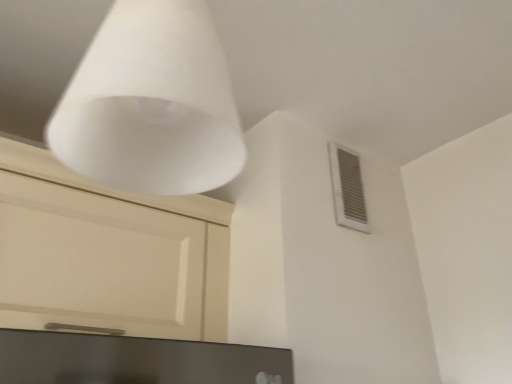
Question: Does white plastic vent at upper right turn towards white matte cone at upper center?

Choices:
 (A) no
 (B) yes

Answer: (A)

Question: Can you confirm if white plastic vent at upper right is taller than white matte cone at upper center?

Choices:
 (A) no
 (B) yes

Answer: (B)

Question: Is white plastic vent at upper right positioned far away from white matte cone at upper center?

Choices:
 (A) yes
 (B) no

Answer: (B)

Question: Can you confirm if white plastic vent at upper right is shorter than white matte cone at upper center?

Choices:
 (A) yes
 (B) no

Answer: (B)

Question: Considering the relative positions of white plastic vent at upper right and white matte cone at upper center in the image provided, is white plastic vent at upper right behind white matte cone at upper center?

Choices:
 (A) no
 (B) yes

Answer: (B)

Question: From a real-world perspective, is white plastic vent at upper right on top of white matte cone at upper center?

Choices:
 (A) yes
 (B) no

Answer: (A)

Question: Does matte black monitor at lower center have a greater height compared to white matte cone at upper center?

Choices:
 (A) no
 (B) yes

Answer: (A)

Question: Does matte black monitor at lower center turn towards white matte cone at upper center?

Choices:
 (A) yes
 (B) no

Answer: (B)

Question: From the image's perspective, would you say matte black monitor at lower center is shown under white matte cone at upper center?

Choices:
 (A) no
 (B) yes

Answer: (B)

Question: From a real-world perspective, is matte black monitor at lower center physically below white matte cone at upper center?

Choices:
 (A) yes
 (B) no

Answer: (A)

Question: Considering the relative sizes of matte black monitor at lower center and white matte cone at upper center in the image provided, is matte black monitor at lower center wider than white matte cone at upper center?

Choices:
 (A) yes
 (B) no

Answer: (A)

Question: Can you confirm if matte black monitor at lower center is shorter than white matte cone at upper center?

Choices:
 (A) no
 (B) yes

Answer: (B)

Question: Considering the relative sizes of white matte cone at upper center and white plastic vent at upper right in the image provided, is white matte cone at upper center bigger than white plastic vent at upper right?

Choices:
 (A) yes
 (B) no

Answer: (A)